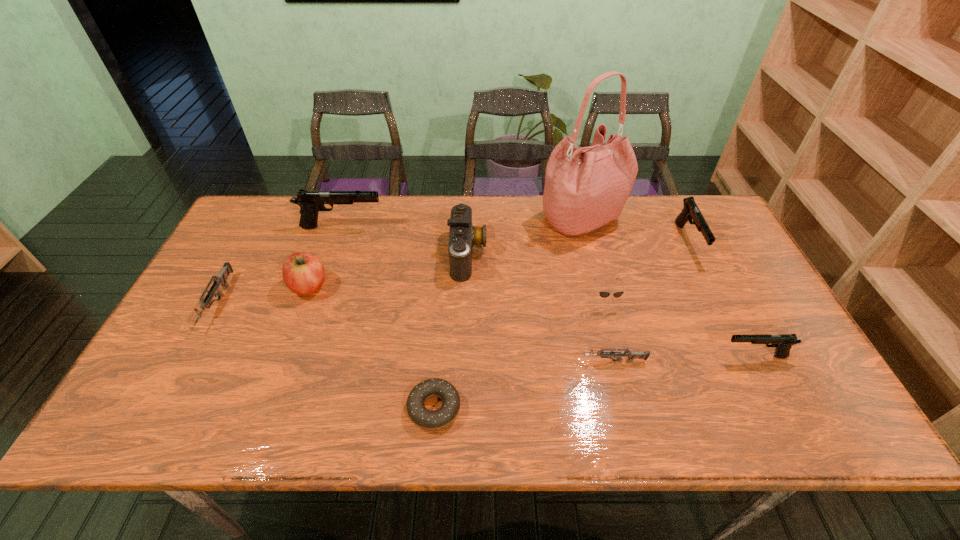
The image size is (960, 540). Find the location of `the tallest object`. the tallest object is located at coordinates (585, 188).

What are the coordinates of `the second tallest object` in the screenshot? It's located at (311, 202).

Identify the location of the tallest gun. The width and height of the screenshot is (960, 540). (311, 202).

I want to click on camera, so click(x=463, y=235).

Locate an element on the screen. The height and width of the screenshot is (540, 960). the second tallest gun is located at coordinates (690, 211).

Image resolution: width=960 pixels, height=540 pixels. What are the coordinates of `apple` in the screenshot? It's located at (303, 273).

You are a GUI agent. You are given a task and a screenshot of the screen. Output one action in this format:
    pyautogui.click(x=<x>, y=<y>)
    Task: Click on the nearest black gun
    
    Given the screenshot: What is the action you would take?
    pyautogui.click(x=783, y=342)

This screenshot has height=540, width=960. Identify the location of the smallest black gun. (783, 342).

Find the location of a particular element. This screenshot has height=540, width=960. sunglasses is located at coordinates (603, 294).

Find the location of a particular element. This screenshot has width=960, height=540. the leftmost gun is located at coordinates (221, 279).